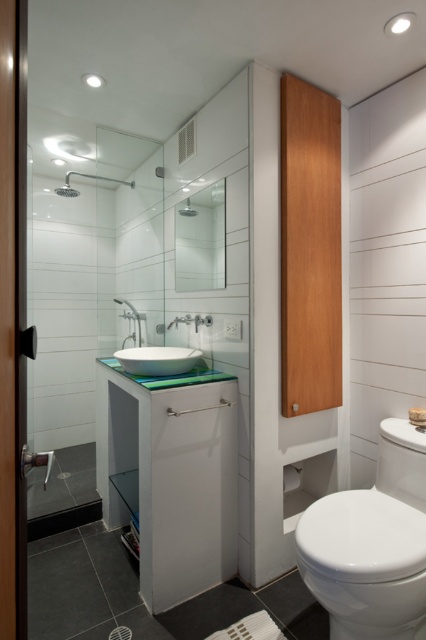
Question: Which object is farther from the camera taking this photo?

Choices:
 (A) matte glass shower at upper center
 (B) white glossy toilet at lower right

Answer: (A)

Question: Can you confirm if white glossy sink at center is smaller than matte silver shower head at upper left?

Choices:
 (A) yes
 (B) no

Answer: (A)

Question: Does matte silver shower head at upper left have a greater width compared to white glossy faucet at upper center?

Choices:
 (A) no
 (B) yes

Answer: (B)

Question: Among these points, which one is farthest from the camera?

Choices:
 (A) (192, 451)
 (B) (74, 189)

Answer: (B)

Question: Among these points, which one is nearest to the camera?

Choices:
 (A) (173, 476)
 (B) (196, 211)

Answer: (A)

Question: Can you confirm if white glossy sink at center is bigger than matte silver shower head at upper left?

Choices:
 (A) yes
 (B) no

Answer: (B)